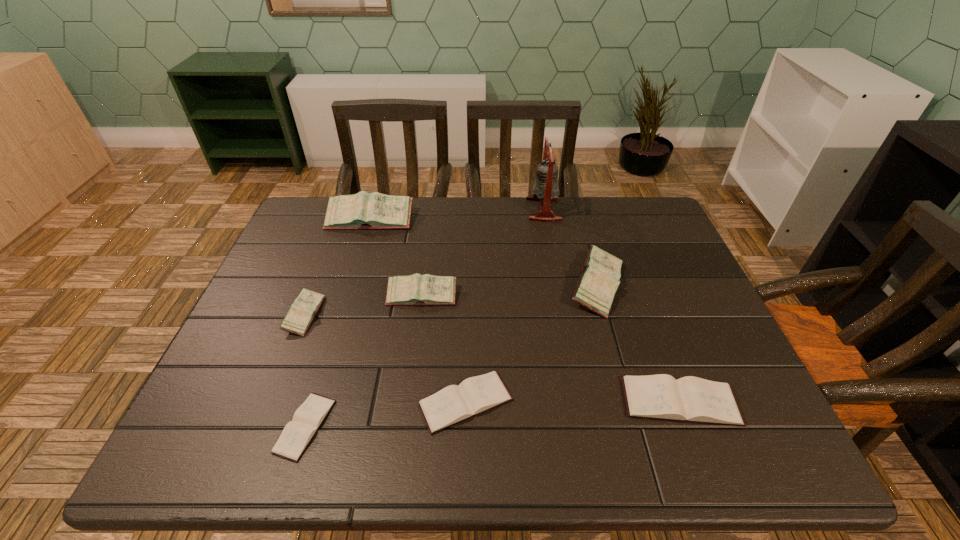
In the image, there is a desktop. Where is `vacant space at the left edge`? The height and width of the screenshot is (540, 960). vacant space at the left edge is located at coordinates (316, 262).

The image size is (960, 540). I want to click on vacant space at the right edge of the desktop, so click(677, 301).

Locate an element on the screen. Image resolution: width=960 pixels, height=540 pixels. free location at the far left corner of the desktop is located at coordinates (298, 218).

I want to click on vacant space at the far right corner of the desktop, so click(632, 227).

Locate an element on the screen. The height and width of the screenshot is (540, 960). free space between the sixth shortest diary and the third shortest object is located at coordinates 638,343.

Locate an element on the screen. Image resolution: width=960 pixels, height=540 pixels. free area in between the rightmost brown diary and the third biggest pink diary is located at coordinates (551, 349).

Image resolution: width=960 pixels, height=540 pixels. Identify the location of vacant area that lies between the second tallest object and the shortest diary. (338, 323).

I want to click on vacant area that lies between the leftmost brown diary and the rightmost brown diary, so click(x=492, y=414).

The height and width of the screenshot is (540, 960). In order to click on vacant space that's between the fourth shortest object and the second smallest pink diary in this screenshot , I will do `click(363, 305)`.

This screenshot has width=960, height=540. Identify the location of vacant area that lies between the tallest diary and the second brown diary from left to right. (418, 311).